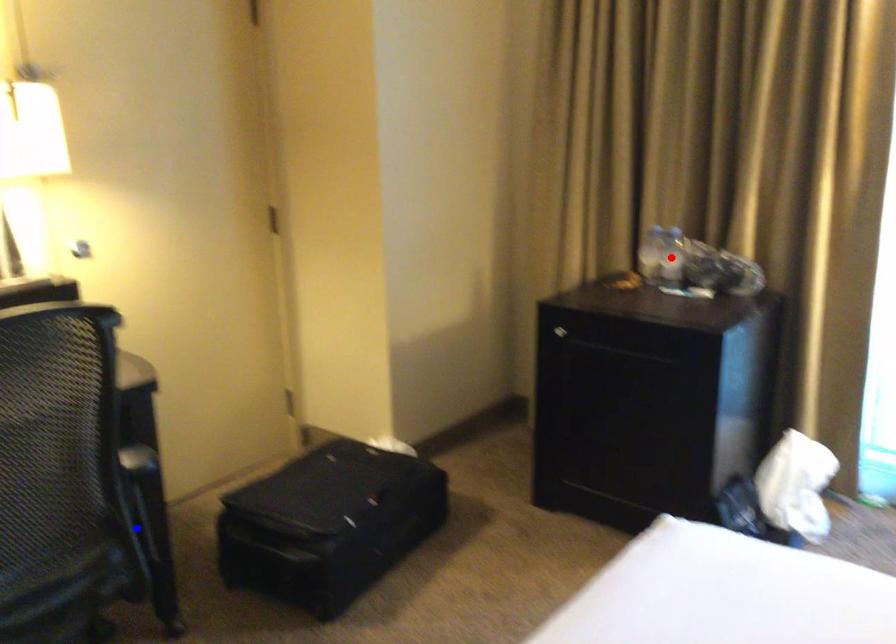
Question: In the image, two points are highlighted. Which point is nearer to the camera? Reply with the corresponding letter.

Choices:
 (A) blue point
 (B) red point

Answer: (A)